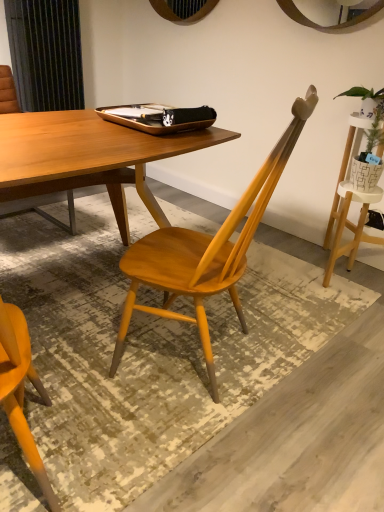
Question: From a real-world perspective, is wooden tray at center physically below matte wood chair at center?

Choices:
 (A) no
 (B) yes

Answer: (A)

Question: Does wooden tray at center touch matte wood chair at center?

Choices:
 (A) yes
 (B) no

Answer: (B)

Question: Does wooden tray at center have a greater height compared to matte wood chair at center?

Choices:
 (A) yes
 (B) no

Answer: (B)

Question: Would you say wooden tray at center is outside matte wood chair at center?

Choices:
 (A) yes
 (B) no

Answer: (A)

Question: Does wooden tray at center have a greater width compared to matte wood chair at center?

Choices:
 (A) no
 (B) yes

Answer: (A)

Question: Can you confirm if wooden tray at center is thinner than matte wood chair at center?

Choices:
 (A) no
 (B) yes

Answer: (B)

Question: Does green leafy plant in woven basket at upper right have a greater height compared to wooden tray at center?

Choices:
 (A) no
 (B) yes

Answer: (B)

Question: Can you confirm if green leafy plant in woven basket at upper right is bigger than wooden tray at center?

Choices:
 (A) yes
 (B) no

Answer: (B)

Question: Is green leafy plant in woven basket at upper right oriented towards wooden tray at center?

Choices:
 (A) no
 (B) yes

Answer: (A)

Question: Considering the relative sizes of green leafy plant in woven basket at upper right and wooden tray at center in the image provided, is green leafy plant in woven basket at upper right wider than wooden tray at center?

Choices:
 (A) yes
 (B) no

Answer: (B)

Question: Can you confirm if green leafy plant in woven basket at upper right is thinner than wooden tray at center?

Choices:
 (A) yes
 (B) no

Answer: (A)

Question: Are green leafy plant in woven basket at upper right and wooden tray at center far apart?

Choices:
 (A) no
 (B) yes

Answer: (A)

Question: Is there a large distance between matte wood chair at center and wooden tray at center?

Choices:
 (A) no
 (B) yes

Answer: (A)